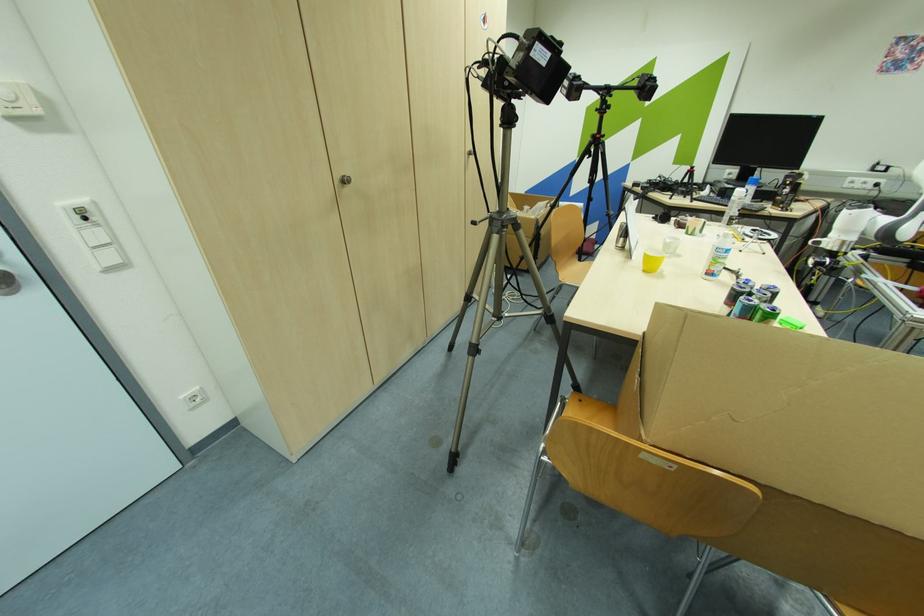
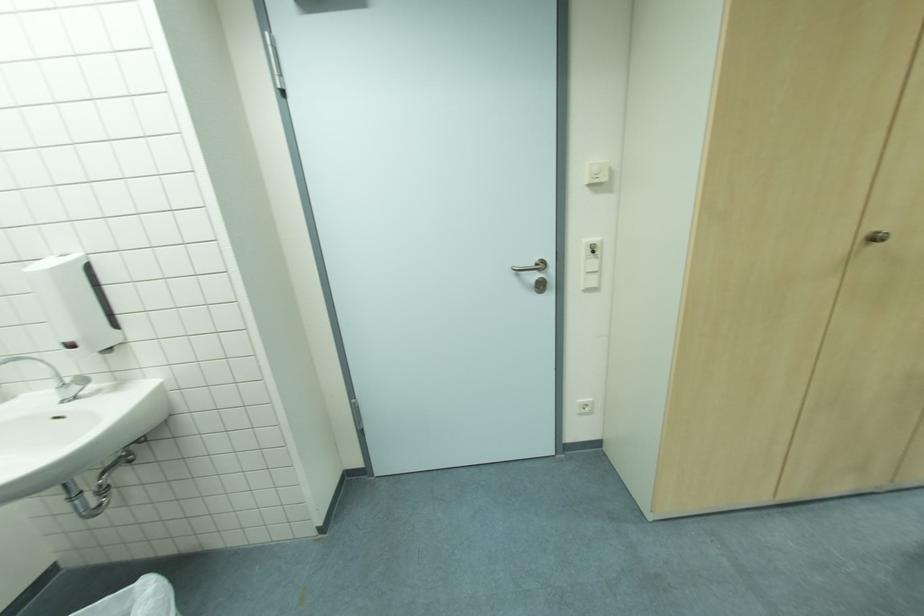
In the second image, find the point that corresponds to pixel 347 177 in the first image.

(877, 233)